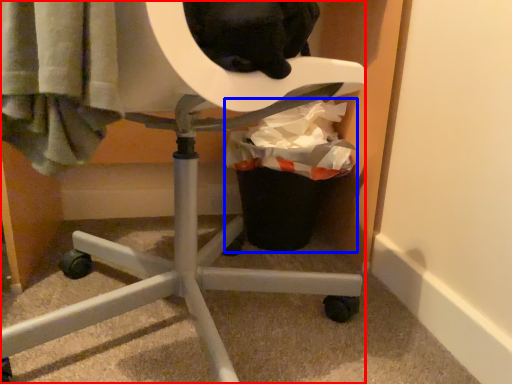
Question: Which object is further to the camera taking this photo, furniture (highlighted by a red box) or garbage (highlighted by a blue box)?

Choices:
 (A) furniture
 (B) garbage

Answer: (B)